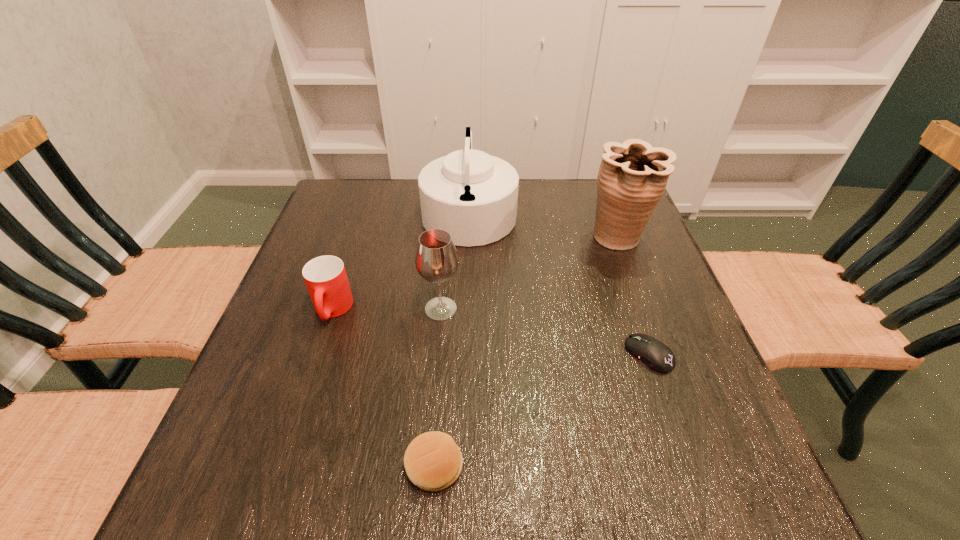
Identify the location of vacant position in the image that satisfies the following two spatial constraints: 1. on the spout of the urn; 2. on the left side of the kettle. Image resolution: width=960 pixels, height=540 pixels. [x=468, y=237].

Where is `free space that satisfies the following two spatial constraints: 1. on the spout of the kettle; 2. on the front side of the fourth shortest object`? free space that satisfies the following two spatial constraints: 1. on the spout of the kettle; 2. on the front side of the fourth shortest object is located at coordinates (467, 309).

This screenshot has height=540, width=960. I want to click on vacant space that satisfies the following two spatial constraints: 1. on the side of the fourth tallest object with the handle; 2. on the right side of the second nearest object, so point(318,354).

At what (x,y) coordinates should I click in order to perform the action: click on free location that satisfies the following two spatial constraints: 1. on the back side of the urn; 2. on the left side of the computer equipment. Please return your answer as a coordinate pair (x, y). The height and width of the screenshot is (540, 960). Looking at the image, I should click on (609, 237).